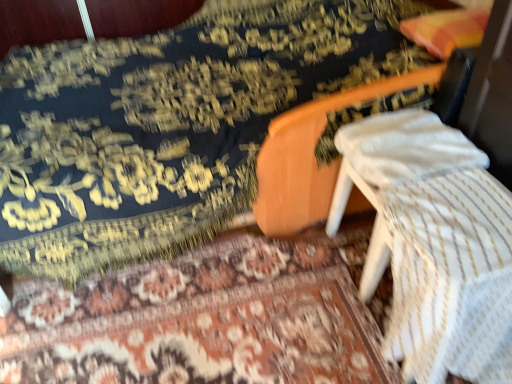
Question: From the image's perspective, is velvet-like dark blue mattress at center located above or below floral carpet at center?

Choices:
 (A) below
 (B) above

Answer: (B)

Question: Based on their sizes in the image, would you say velvet-like dark blue mattress at center is bigger or smaller than floral carpet at center?

Choices:
 (A) big
 (B) small

Answer: (A)

Question: Based on their relative distances, which object is nearer to the velvet-like dark blue mattress at center?

Choices:
 (A) floral carpet at center
 (B) white striped fabric at lower right
 (C) white cotton pillow at center

Answer: (A)

Question: Which object is positioned farthest from the floral carpet at center?

Choices:
 (A) white cotton pillow at center
 (B) white striped fabric at lower right
 (C) velvet-like dark blue mattress at center

Answer: (A)